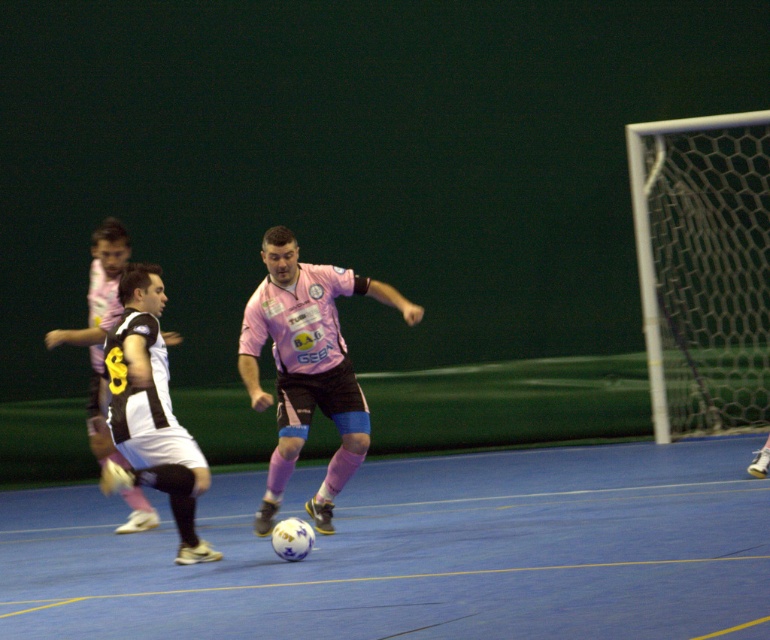
You are a referee in the soccer match. You need to ensure that the players are not too close to each other during the game. The minimum distance required between players is 6 feet. Are the pink matte jersey at center and the black and white jersey at left maintaining the required distance?

The pink matte jersey at center and the black and white jersey at left are 6.46 feet apart from each other, which is just over the 6 feet requirement. Therefore, they are maintaining the required distance.

You are a soccer player trying to position yourself near the ball during the match. Where should you move to in relation to the blue synthetic floor at center?

The blue synthetic floor at center is located at point (420, 552), so you should move towards that coordinate to be near the ball.